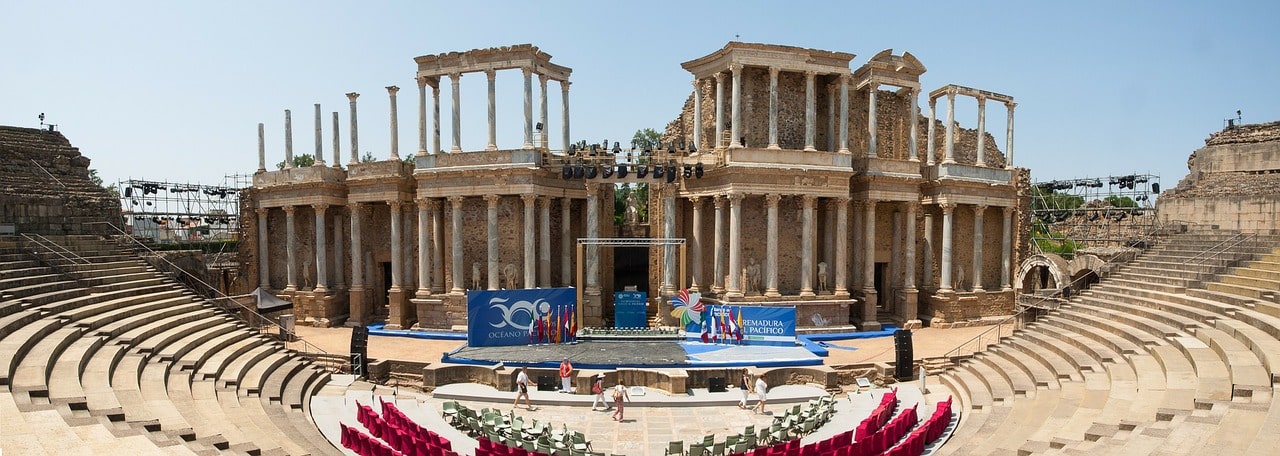
You are a GUI agent. You are given a task and a screenshot of the screen. Output one action in this format:
    pyautogui.click(x=<x>, y=<y>)
    Task: Click on the statue
    Image resolution: width=1280 pixels, height=456 pixels.
    Given the screenshot: What is the action you would take?
    [754, 276], [822, 277], [963, 276], [515, 272], [475, 269]